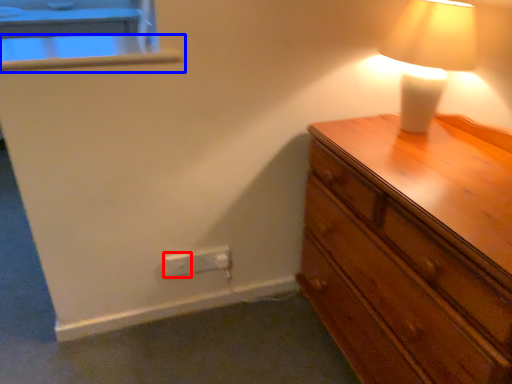
Question: Which of the following is the farthest to the observer, electric outlet (highlighted by a red box) or window sill (highlighted by a blue box)?

Choices:
 (A) electric outlet
 (B) window sill

Answer: (A)